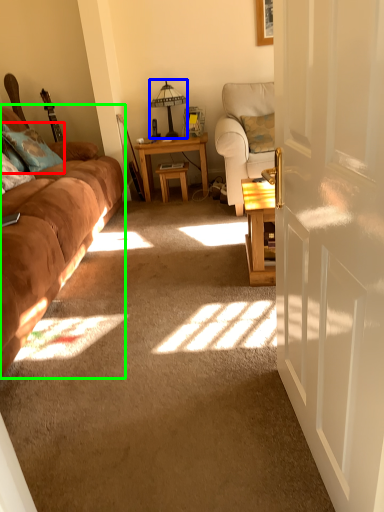
Question: Which object is positioned closest to pillow (highlighted by a red box)? Select from table lamp (highlighted by a blue box) and studio couch (highlighted by a green box).

Choices:
 (A) table lamp
 (B) studio couch

Answer: (B)